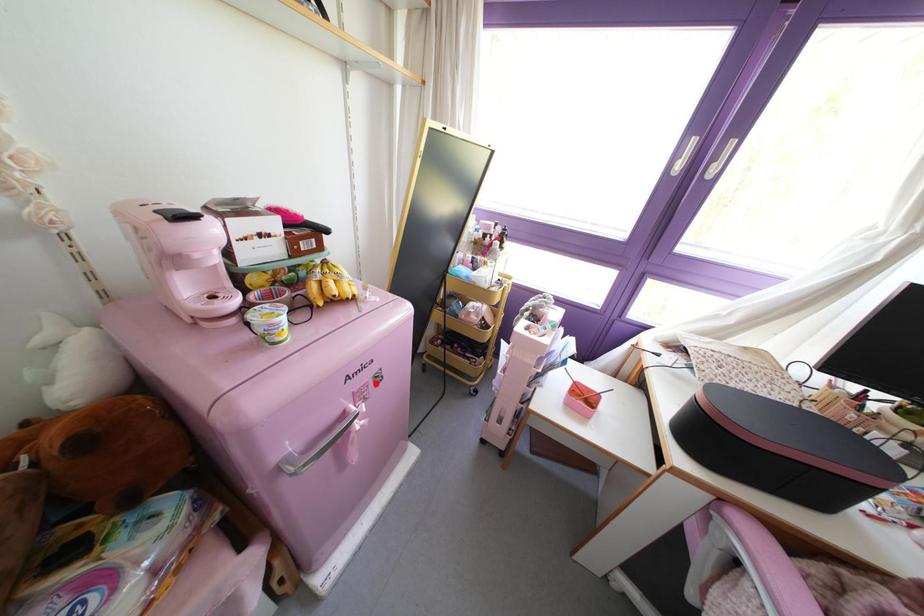
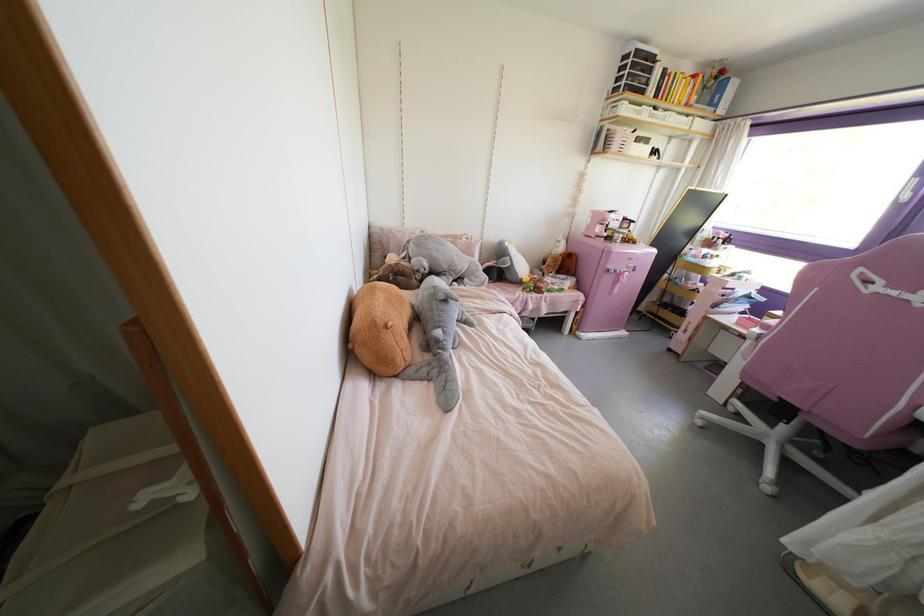
Question: I am providing you with two images of the same scene from different viewpoints. In image1, a red point is highlighted. Considering the same 3D point in image2, which of the following is correct?

Choices:
 (A) It is closer
 (B) It is farther

Answer: (A)